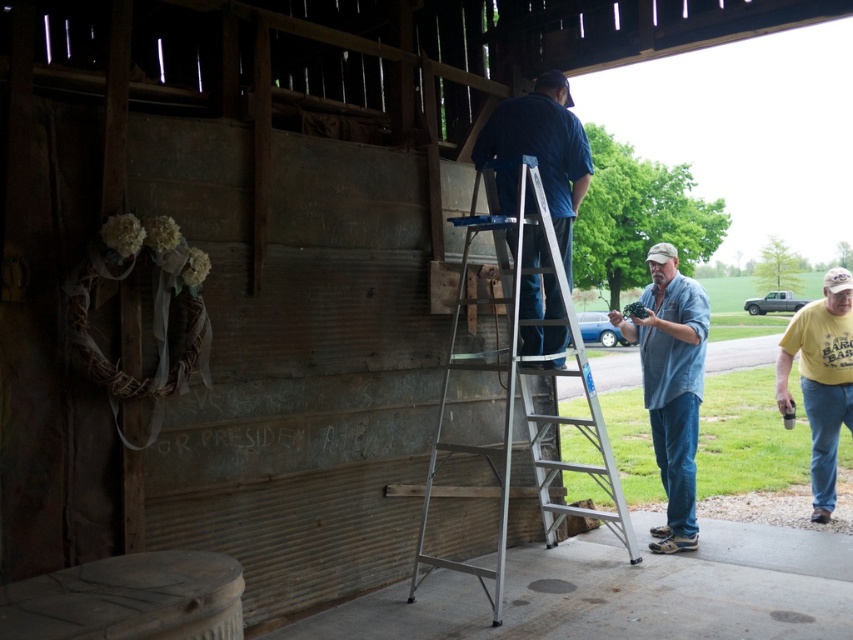
You are standing at the entrance of the barn and want to greet the person in the blue fabric shirt at upper center and the denim shirt at center. Which person should you approach first if you want to greet the one closer to your right side?

The denim shirt at center is to the right of the blue fabric shirt at upper center, so you should approach the denim shirt at center first as it is closer to your right side.

You are a painter who needs to reach a high spot on the barn wall. You see the silver metallic ladder at center and the denim shirt at center. Which object can you use to safely reach the height needed?

The silver metallic ladder at center is taller than the denim shirt at center, so you should use the silver metallic ladder at center to safely reach the height needed.